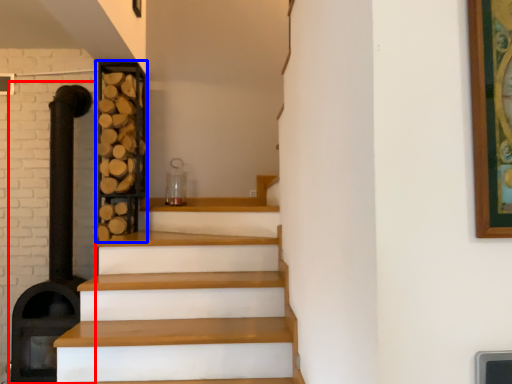
Question: Among these objects, which one is farthest to the camera, fireplace (highlighted by a red box) or shelf (highlighted by a blue box)?

Choices:
 (A) fireplace
 (B) shelf

Answer: (B)